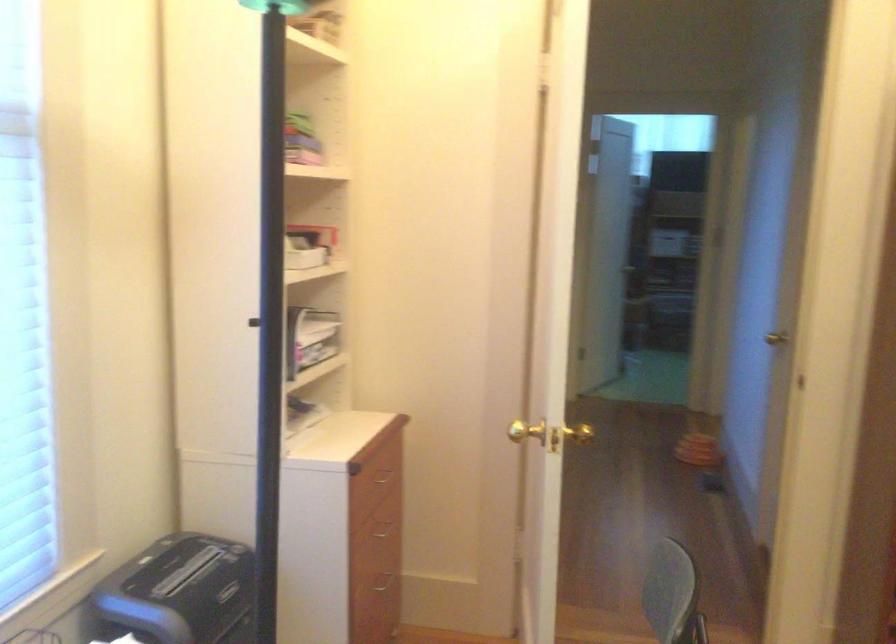
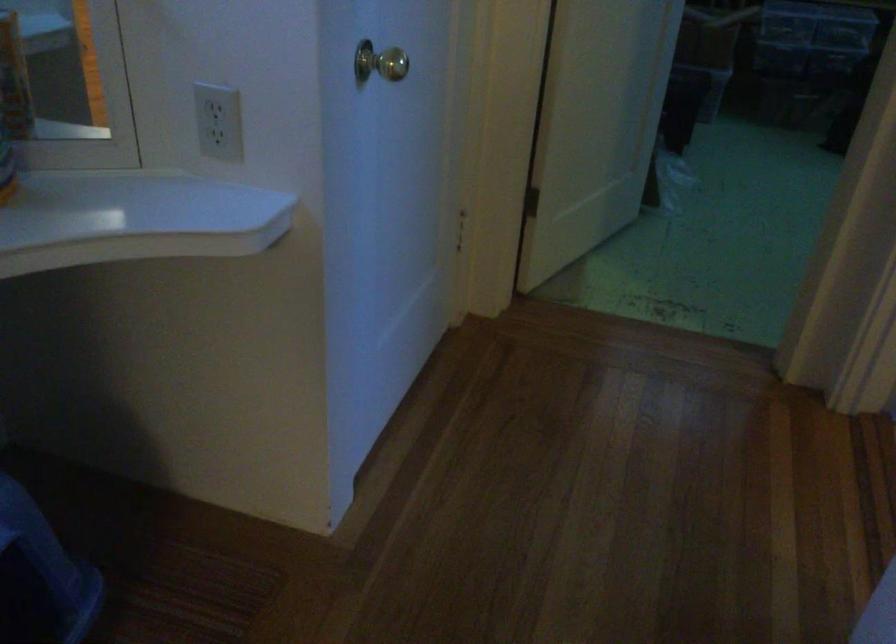
Question: The images are taken continuously from a first-person perspective. In which direction are you moving?

Choices:
 (A) Left
 (B) Right
 (C) Forward
 (D) Backward

Answer: (C)